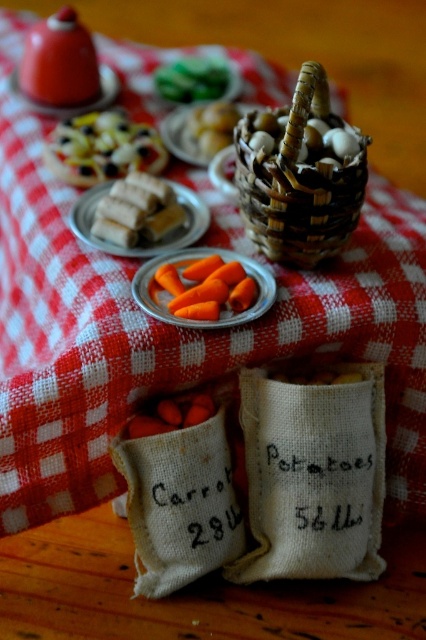
You are setting up a picnic scene and need to place the orange matte carrots at center and the white matte sugar cube at center on the table. According to the image, which object is positioned closer to the viewer?

The white matte sugar cube at center is closer to the viewer because the orange matte carrots at center is behind it.

You have a small toy car that is 10 cm long. You want to place it on either the shiny silver tray at upper left or the orange matte carrot at center. Which object can the toy car fit on if the tray is wider than the carrot?

The shiny silver tray at upper left is wider than the orange matte carrot at center, so the toy car can fit on the shiny silver tray at upper left.

You are setting up a picnic scene and want to place the white matte sugar cube at center and the orange matte carrot at center in a way that they are both visible. Can you arrange them so that neither is completely hidden?

The white matte sugar cube at center is positioned over the orange matte carrot at center, so arranging them without one hiding the other would require moving the white matte sugar cube at center away from the orange matte carrot at center.